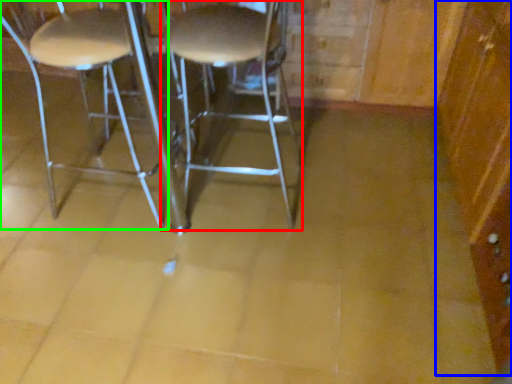
Question: Which is farther away from stool (highlighted by a red box)? dresser (highlighted by a blue box) or chair (highlighted by a green box)?

Choices:
 (A) dresser
 (B) chair

Answer: (A)